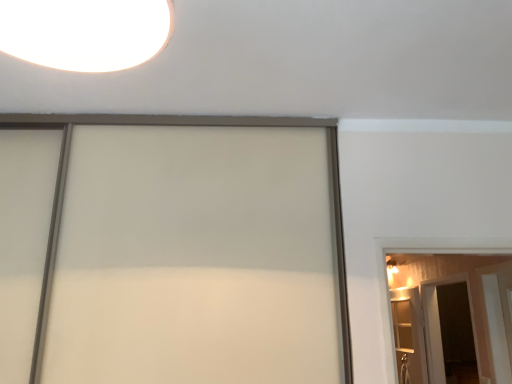
Question: Considering the relative positions of wooden elevator at right and transparent glass screen door at lower right in the image provided, is wooden elevator at right to the left of transparent glass screen door at lower right from the viewer's perspective?

Choices:
 (A) no
 (B) yes

Answer: (B)

Question: Is wooden elevator at right further to camera compared to transparent glass screen door at lower right?

Choices:
 (A) no
 (B) yes

Answer: (A)

Question: Is wooden elevator at right bigger than transparent glass screen door at lower right?

Choices:
 (A) no
 (B) yes

Answer: (A)

Question: From a real-world perspective, is wooden elevator at right on transparent glass screen door at lower right?

Choices:
 (A) no
 (B) yes

Answer: (A)

Question: Can you confirm if wooden elevator at right is wider than transparent glass screen door at lower right?

Choices:
 (A) no
 (B) yes

Answer: (A)

Question: Looking at their shapes, would you say transparent glass screen door at lower right is wider or thinner than white glossy barn door at right?

Choices:
 (A) wide
 (B) thin

Answer: (B)

Question: Is point (480, 372) closer or farther from the camera than point (445, 283)?

Choices:
 (A) closer
 (B) farther

Answer: (A)

Question: From the image's perspective, is transparent glass screen door at lower right positioned above or below white glossy barn door at right?

Choices:
 (A) below
 (B) above

Answer: (A)

Question: Is transparent glass screen door at lower right spatially inside white glossy barn door at right, or outside of it?

Choices:
 (A) outside
 (B) inside

Answer: (A)

Question: Is point (400, 374) positioned closer to the camera than point (442, 365)?

Choices:
 (A) farther
 (B) closer

Answer: (B)

Question: From the image's perspective, is wooden elevator at right above or below transparent glass screen door at lower right?

Choices:
 (A) below
 (B) above

Answer: (A)

Question: Is wooden elevator at right bigger or smaller than transparent glass screen door at lower right?

Choices:
 (A) big
 (B) small

Answer: (B)

Question: Do you think wooden elevator at right is within transparent glass screen door at lower right, or outside of it?

Choices:
 (A) inside
 (B) outside

Answer: (B)

Question: Based on their sizes in the image, would you say white glossy barn door at right is bigger or smaller than wooden elevator at right?

Choices:
 (A) small
 (B) big

Answer: (B)

Question: Considering the positions of white glossy barn door at right and wooden elevator at right in the image, is white glossy barn door at right taller or shorter than wooden elevator at right?

Choices:
 (A) short
 (B) tall

Answer: (A)